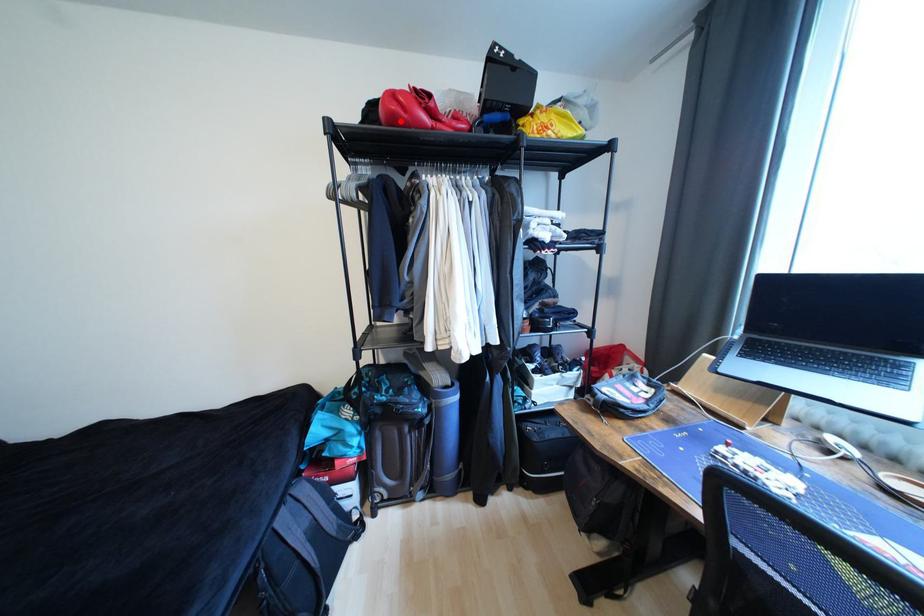
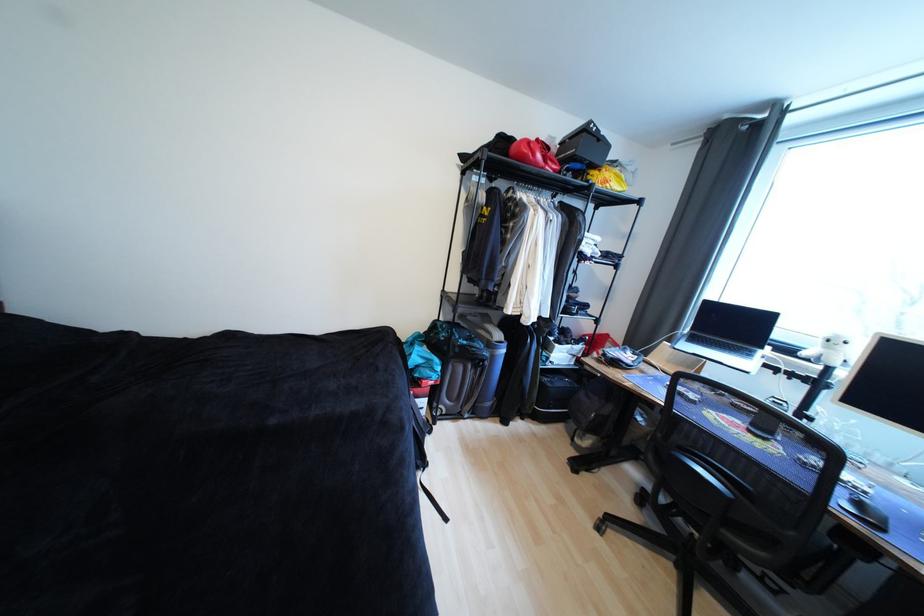
Where in the second image is the point corresponding to the highlighted location from the first image?

(529, 159)